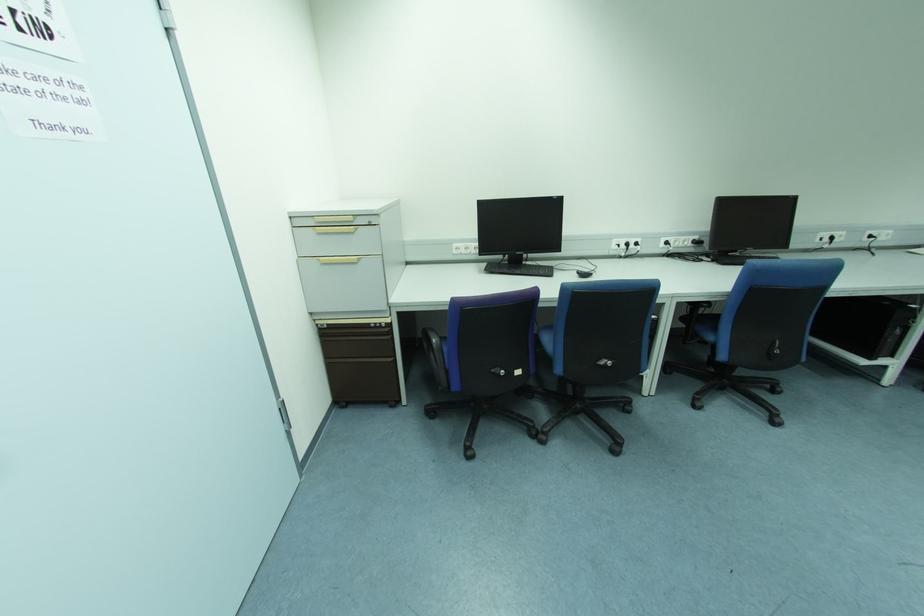
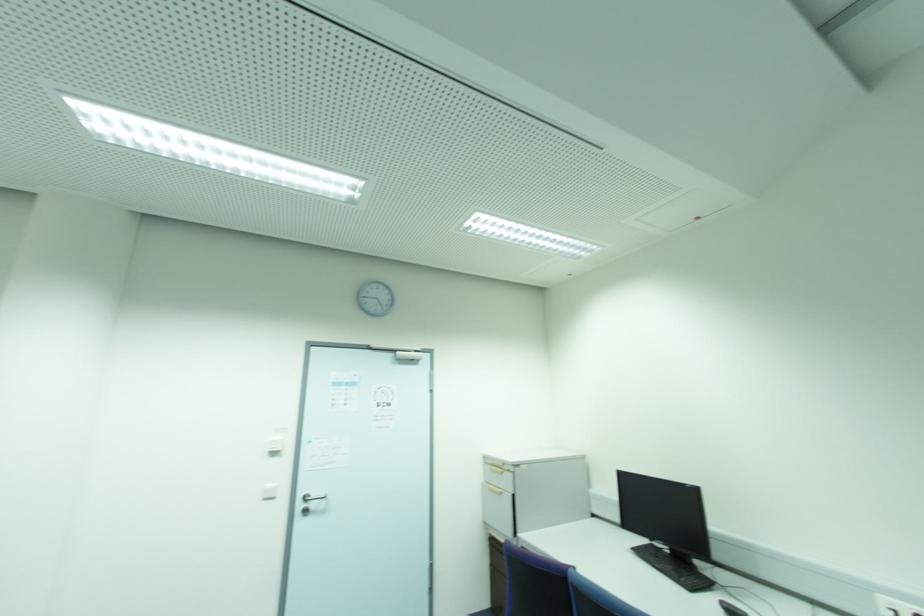
In the second image, find the point that corresponds to the point at 357,230 in the first image.

(503, 472)